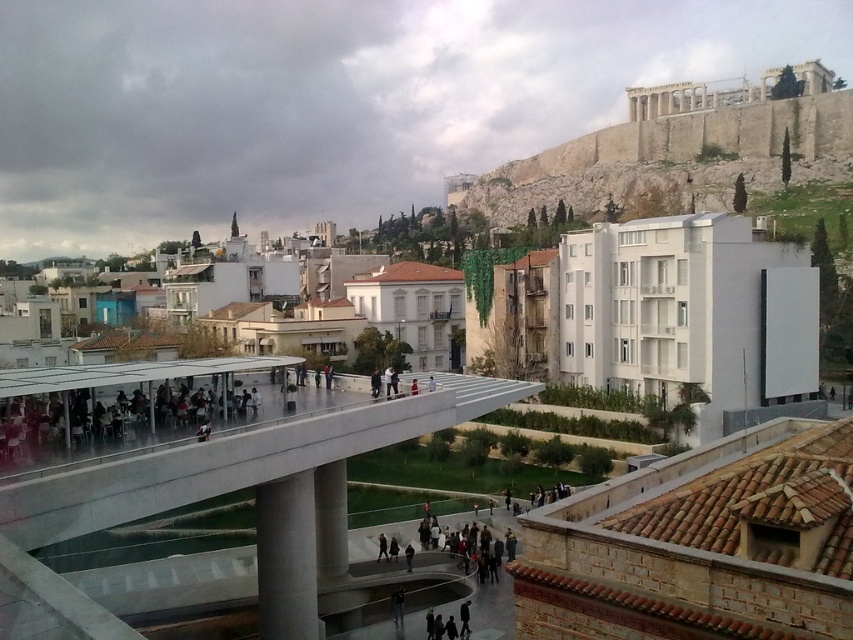
The height and width of the screenshot is (640, 853). What do you see at coordinates (212, 497) in the screenshot?
I see `white concrete overpass at center` at bounding box center [212, 497].

Can you confirm if white concrete overpass at center is positioned below gray concrete pillar at center?

Actually, white concrete overpass at center is above gray concrete pillar at center.

Between point (525, 388) and point (309, 584), which one is positioned behind?

The point (525, 388) is more distant.

Locate an element on the screen. white concrete overpass at center is located at coordinates (212, 497).

Between white concrete overpass at center and white concrete pillar at center, which one appears on the right side from the viewer's perspective?

white concrete pillar at center

Is white concrete overpass at center thinner than white concrete pillar at center?

No, white concrete overpass at center is not thinner than white concrete pillar at center.

This screenshot has width=853, height=640. Describe the element at coordinates (212, 497) in the screenshot. I see `white concrete overpass at center` at that location.

Where is `white concrete overpass at center`? white concrete overpass at center is located at coordinates (212, 497).

In the scene shown: Can you confirm if gray concrete pillar at center is shorter than white concrete pillar at center?

Yes.

Can you confirm if gray concrete pillar at center is wider than white concrete pillar at center?

No.

Does point (308, 588) come closer to viewer compared to point (318, 536)?

Yes.

Where is `gray concrete pillar at center`? gray concrete pillar at center is located at coordinates (286, 557).